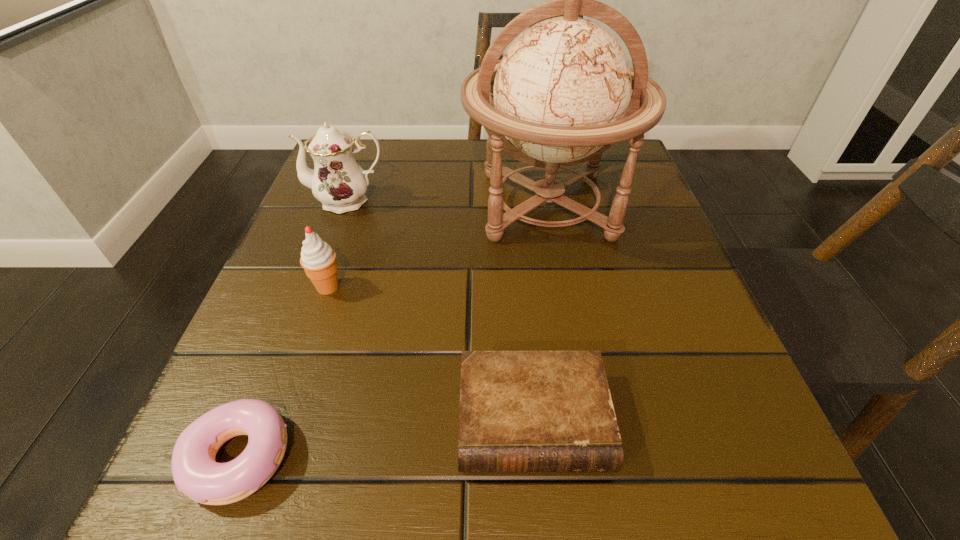
What are the coordinates of `object present at the far right corner` in the screenshot? It's located at (561, 94).

In the image, there is a desktop. Where is `vacant space at the far edge`? This screenshot has height=540, width=960. vacant space at the far edge is located at coordinates (411, 198).

This screenshot has width=960, height=540. Find the location of `blank area at the near edge`. blank area at the near edge is located at coordinates (354, 453).

In the image, there is a desktop. What are the coordinates of `vacant space at the left edge` in the screenshot? It's located at click(372, 203).

In order to click on free space at the right edge of the desktop in this screenshot , I will do `click(647, 215)`.

What are the coordinates of `vacant area at the far left corner` in the screenshot? It's located at (359, 159).

Where is `free space at the near right corner of the desktop`? This screenshot has height=540, width=960. free space at the near right corner of the desktop is located at coordinates (669, 503).

Identify the location of free area in between the chinaware and the third farthest object. (338, 244).

The height and width of the screenshot is (540, 960). I want to click on free spot between the doughnut and the chinaware, so click(294, 328).

Identify the location of free point between the tallest object and the chinaware. Image resolution: width=960 pixels, height=540 pixels. (447, 203).